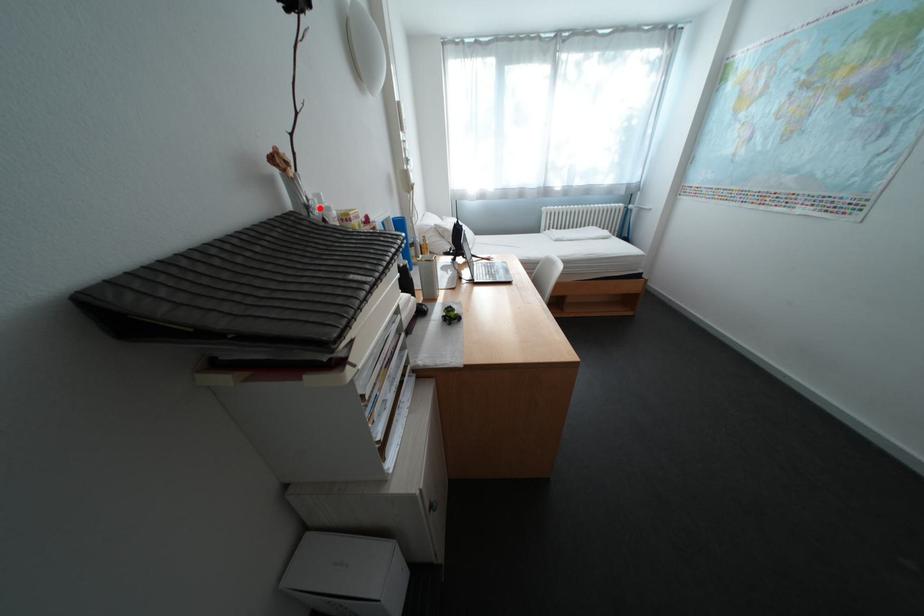
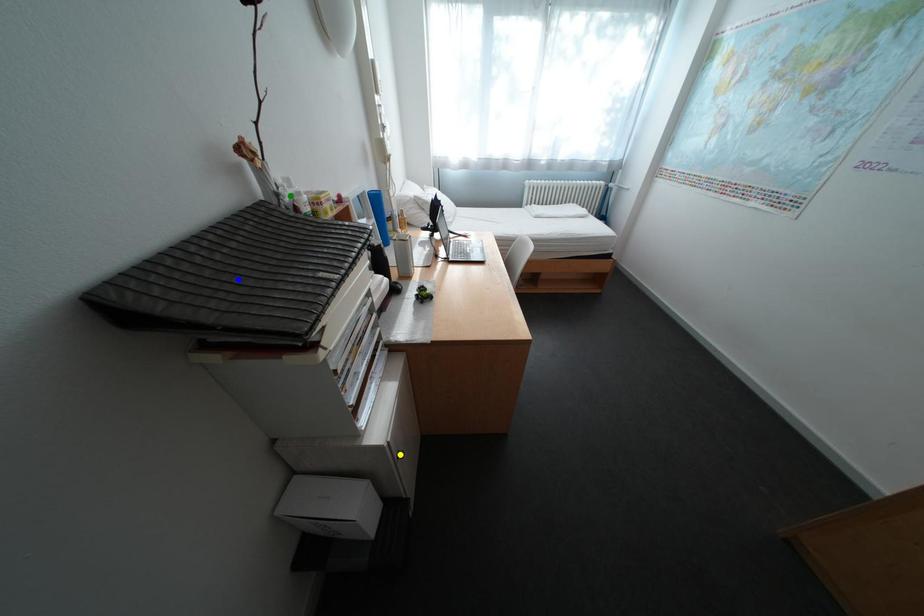
Question: I am providing you with two images of the same scene from different viewpoints. A red point is marked on the first image. You are given multiple points on the second image. Which point in image 2 represents the same 3d spot as the red point in image 1?

Choices:
 (A) yellow point
 (B) blue point
 (C) green point

Answer: (C)